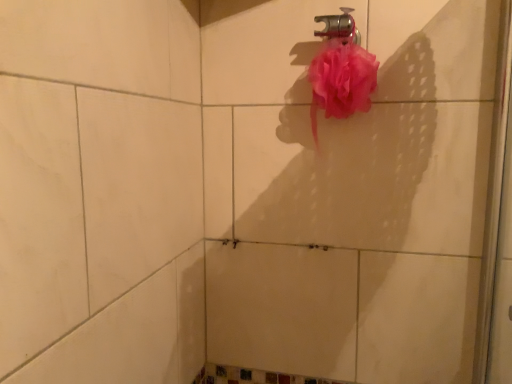
In order to face pink mesh sponge at upper right, should I rotate leftwards or rightwards?

A 11.878 degree turn to the right will do.

Locate an element on the screen. This screenshot has height=384, width=512. pink mesh sponge at upper right is located at coordinates [342, 80].

The width and height of the screenshot is (512, 384). Describe the element at coordinates (342, 80) in the screenshot. I see `pink mesh sponge at upper right` at that location.

Locate an element on the screen. The height and width of the screenshot is (384, 512). metallic faucet at upper center is located at coordinates (339, 27).

Describe the element at coordinates (339, 27) in the screenshot. I see `metallic faucet at upper center` at that location.

The height and width of the screenshot is (384, 512). Find the location of `pink mesh sponge at upper right`. pink mesh sponge at upper right is located at coordinates pyautogui.click(x=342, y=80).

Which object is positioned more to the right, pink mesh sponge at upper right or metallic faucet at upper center?

pink mesh sponge at upper right is more to the right.

Does pink mesh sponge at upper right lie behind metallic faucet at upper center?

No.

Does point (365, 53) lie in front of point (350, 25)?

Yes, point (365, 53) is in front of point (350, 25).

From the image's perspective, is pink mesh sponge at upper right located above or below metallic faucet at upper center?

Clearly, from the image's perspective, pink mesh sponge at upper right is below metallic faucet at upper center.

From a real-world perspective, is pink mesh sponge at upper right below metallic faucet at upper center?

Correct, in the physical world, pink mesh sponge at upper right is lower than metallic faucet at upper center.

Considering the relative sizes of pink mesh sponge at upper right and metallic faucet at upper center in the image provided, is pink mesh sponge at upper right thinner than metallic faucet at upper center?

No.

Considering the sizes of objects pink mesh sponge at upper right and metallic faucet at upper center in the image provided, who is taller, pink mesh sponge at upper right or metallic faucet at upper center?

Standing taller between the two is pink mesh sponge at upper right.

Does pink mesh sponge at upper right have a larger size compared to metallic faucet at upper center?

Indeed, pink mesh sponge at upper right has a larger size compared to metallic faucet at upper center.

Is pink mesh sponge at upper right situated inside metallic faucet at upper center or outside?

The correct answer is: outside.

Are pink mesh sponge at upper right and metallic faucet at upper center far apart?

No, pink mesh sponge at upper right is in close proximity to metallic faucet at upper center.

Is pink mesh sponge at upper right facing away from metallic faucet at upper center?

No, pink mesh sponge at upper right is not facing away from metallic faucet at upper center.

How many degrees apart are the facing directions of pink mesh sponge at upper right and metallic faucet at upper center?

0.00184 degrees separate the facing orientations of pink mesh sponge at upper right and metallic faucet at upper center.

Where is `plumbing fixture positioned vertically above the pink mesh sponge at upper right (from a real-world perspective)`? This screenshot has height=384, width=512. plumbing fixture positioned vertically above the pink mesh sponge at upper right (from a real-world perspective) is located at coordinates (339, 27).

Can you confirm if metallic faucet at upper center is positioned to the right of pink mesh sponge at upper right?

Incorrect, metallic faucet at upper center is not on the right side of pink mesh sponge at upper right.

Between metallic faucet at upper center and pink mesh sponge at upper right, which one is positioned in front?

pink mesh sponge at upper right is closer to the camera.

Which is less distant, (328, 18) or (367, 71)?

The point (367, 71) is closer.

From the image's perspective, which one is positioned higher, metallic faucet at upper center or pink mesh sponge at upper right?

metallic faucet at upper center appears higher in the image.

From a real-world perspective, is metallic faucet at upper center below pink mesh sponge at upper right?

No, from a real-world perspective, metallic faucet at upper center is not beneath pink mesh sponge at upper right.

Considering the sizes of objects metallic faucet at upper center and pink mesh sponge at upper right in the image provided, who is thinner, metallic faucet at upper center or pink mesh sponge at upper right?

With smaller width is metallic faucet at upper center.

From the picture: Considering the sizes of objects metallic faucet at upper center and pink mesh sponge at upper right in the image provided, who is shorter, metallic faucet at upper center or pink mesh sponge at upper right?

metallic faucet at upper center is shorter.

Considering the sizes of metallic faucet at upper center and pink mesh sponge at upper right in the image, is metallic faucet at upper center bigger or smaller than pink mesh sponge at upper right?

metallic faucet at upper center is smaller than pink mesh sponge at upper right.

Would you say metallic faucet at upper center is outside pink mesh sponge at upper right?

Indeed, metallic faucet at upper center is completely outside pink mesh sponge at upper right.

Would you consider metallic faucet at upper center to be distant from pink mesh sponge at upper right?

No.

Is metallic faucet at upper center looking in the opposite direction of pink mesh sponge at upper right?

That's not correct — metallic faucet at upper center is not looking away from pink mesh sponge at upper right.

What's the angular difference between metallic faucet at upper center and pink mesh sponge at upper right's facing directions?

They differ by 0.00184 degrees in their facing directions.

The height and width of the screenshot is (384, 512). I want to click on blood located on the right of metallic faucet at upper center, so click(x=342, y=80).

Where is `blood to the right of metallic faucet at upper center`? blood to the right of metallic faucet at upper center is located at coordinates (342, 80).

Identify the location of plumbing fixture lying on the left of pink mesh sponge at upper right. (339, 27).